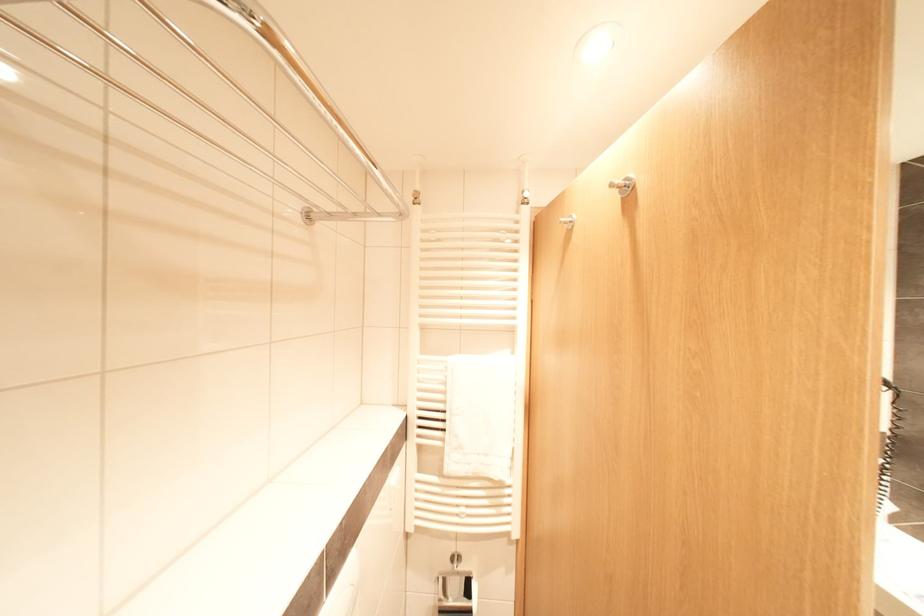
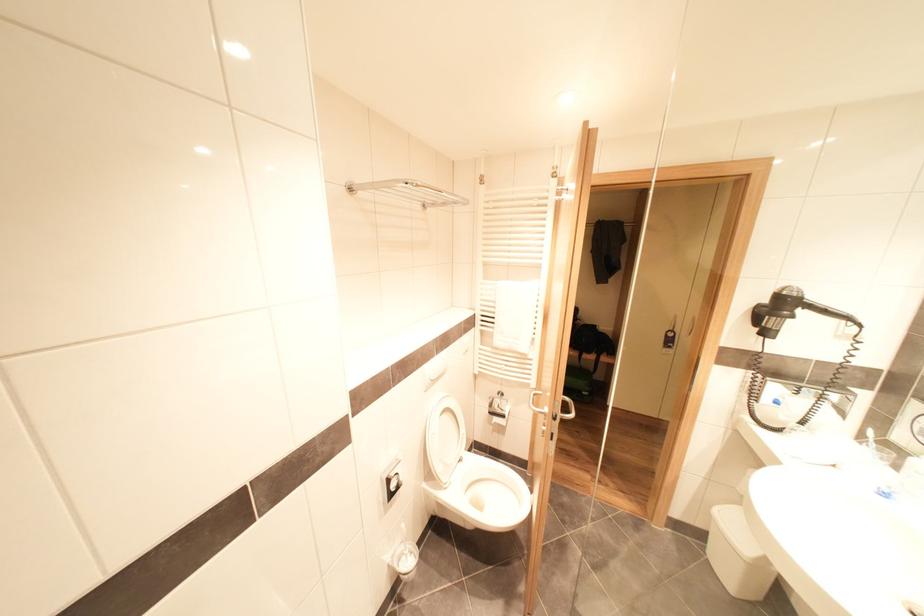
Question: The images are taken continuously from a first-person perspective. In which direction is your viewpoint rotating?

Choices:
 (A) Left
 (B) Right
 (C) Up
 (D) Down

Answer: (A)